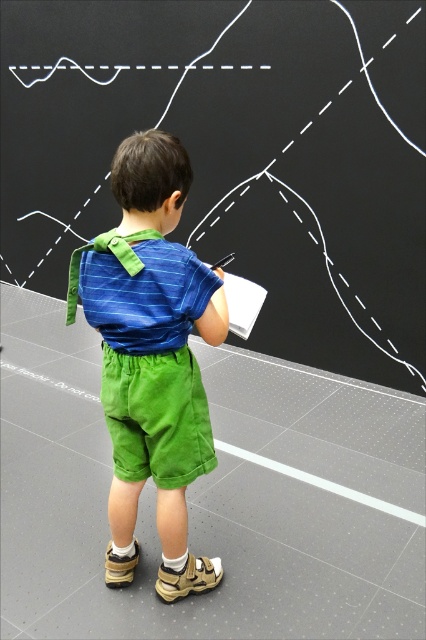
Question: Can you confirm if blue striped shirt at back is thinner than green corduroy shorts at center?

Choices:
 (A) yes
 (B) no

Answer: (B)

Question: Which object is closer to the camera taking this photo?

Choices:
 (A) blue striped shirt at center
 (B) blue striped shirt at back

Answer: (A)

Question: Can you confirm if blue striped shirt at center is bigger than green corduroy shorts at center?

Choices:
 (A) yes
 (B) no

Answer: (A)

Question: Is blue striped shirt at center above green corduroy shorts at center?

Choices:
 (A) yes
 (B) no

Answer: (A)

Question: Which point is closer to the camera?

Choices:
 (A) green corduroy shorts at center
 (B) blue striped shirt at center
 (C) blue striped shirt at back

Answer: (B)

Question: Which of the following is the farthest from the observer?

Choices:
 (A) (123, 324)
 (B) (155, 372)

Answer: (B)